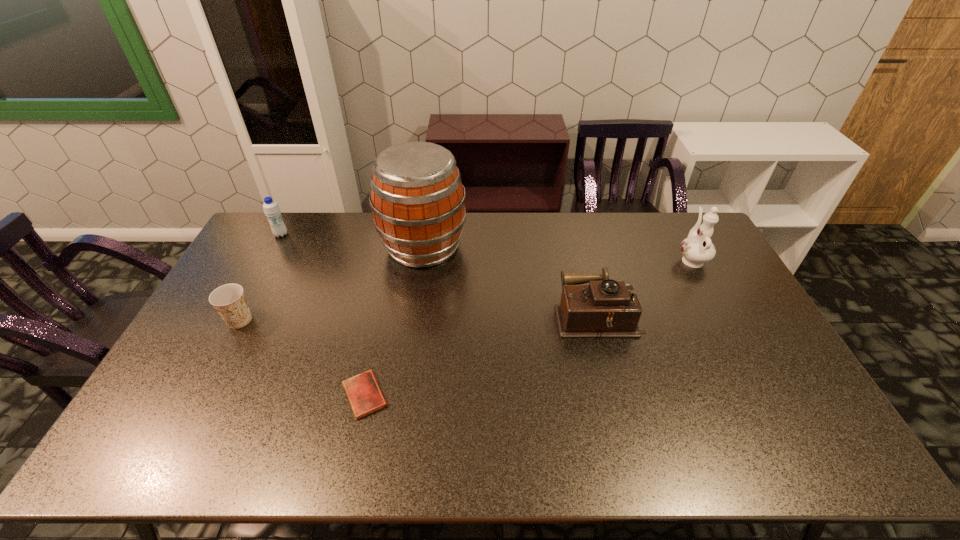
The height and width of the screenshot is (540, 960). Identify the location of vacant area between the Dixie cup and the rightmost object. (466, 289).

Identify which object is located as the nearest to the Dixie cup. Please provide its 2D coordinates. Your answer should be formatted as a tuple, i.e. [(x, y)], where the tuple contains the x and y coordinates of a point satisfying the conditions above.

[(364, 394)]

The height and width of the screenshot is (540, 960). Find the location of `object that is the second closest one to the tallest object`. object that is the second closest one to the tallest object is located at coordinates (271, 209).

Identify the location of vacant space that satisfies the following two spatial constraints: 1. on the front side of the fifth tallest object; 2. on the left side of the nearest object. (201, 395).